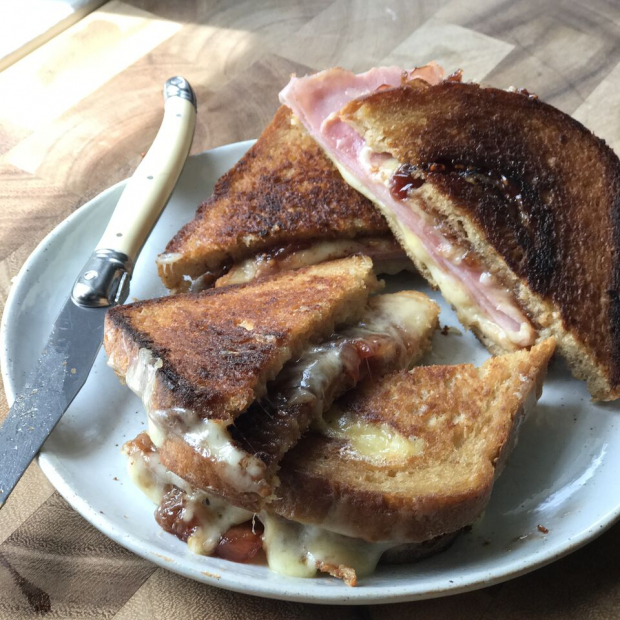
At what (x,y) coordinates should I click in order to perform the action: click on table surface. Please return your answer as a coordinate pair (x, y). The width and height of the screenshot is (620, 620). Looking at the image, I should click on (90, 576).